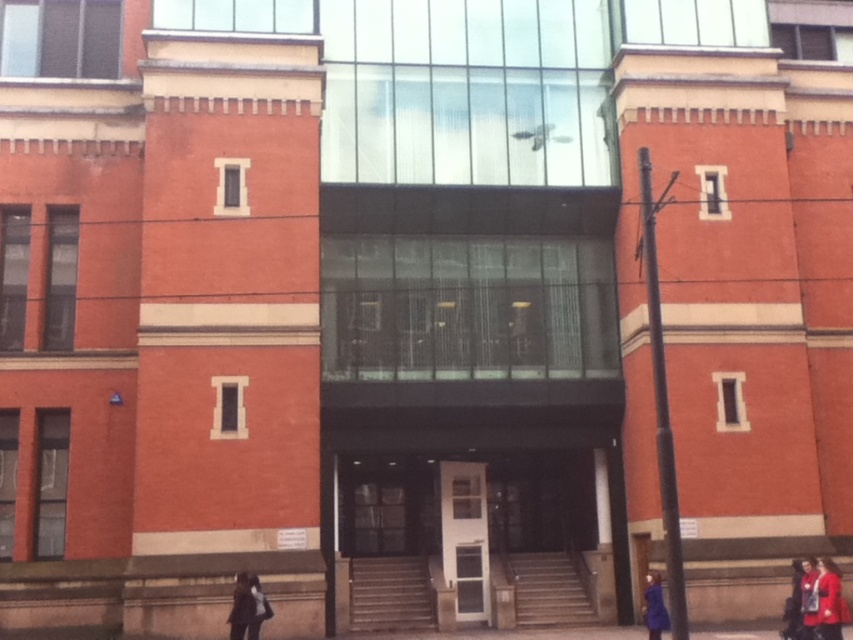
You are a visitor approaching the building and see the white glass door at center and the dark gray fabric jacket at lower left. Which object is closer to the ground?

The white glass door at center is closer to the ground since it is located below the dark gray fabric jacket at lower left.